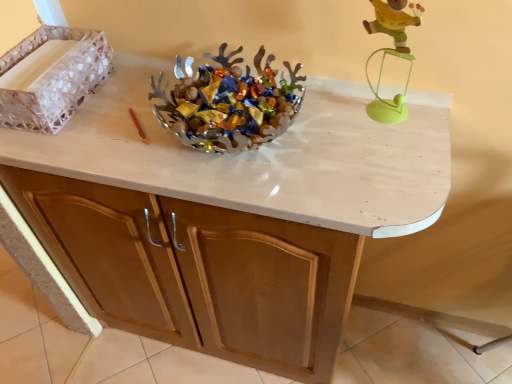
This screenshot has width=512, height=384. What do you see at coordinates (197, 272) in the screenshot? I see `matte wood cabinet at center` at bounding box center [197, 272].

What do you see at coordinates (228, 103) in the screenshot? The image size is (512, 384). I see `metallic silver bowl at center` at bounding box center [228, 103].

In order to face metallic silver bowl at center, should I rotate leftwards or rightwards?

Rotate your view left by about 4.968°.

Find the location of a particular element. The height and width of the screenshot is (384, 512). matte wood cabinet at center is located at coordinates coord(197,272).

Locate an element on the screen. The width and height of the screenshot is (512, 384). stuff below the white textured tray at left (from the image's perspective) is located at coordinates (228, 103).

Is white textured tray at left directly adjacent to metallic silver bowl at center?

white textured tray at left is not next to metallic silver bowl at center, and they're not touching.

Is white textured tray at left looking in the opposite direction of metallic silver bowl at center?

No, white textured tray at left is not facing away from metallic silver bowl at center.

In terms of height, does white textured tray at left look taller or shorter compared to matte wood cabinet at center?

Considering their sizes, white textured tray at left has less height than matte wood cabinet at center.

Is point (35, 108) positioned in front of point (101, 254)?

That is True.

In the scene shown: Is white textured tray at left wider than matte wood cabinet at center?

No.

At what (x,y) coordinates should I click in order to perform the action: click on cabinetry in front of the metallic silver bowl at center. Please return your answer as a coordinate pair (x, y). Looking at the image, I should click on (197, 272).

Considering the relative sizes of metallic silver bowl at center and matte wood cabinet at center in the image provided, is metallic silver bowl at center smaller than matte wood cabinet at center?

Yes, metallic silver bowl at center is smaller than matte wood cabinet at center.

Is matte wood cabinet at center located within metallic silver bowl at center?

That's incorrect, matte wood cabinet at center is not inside metallic silver bowl at center.

Are metallic silver bowl at center and matte wood cabinet at center located far from each other?

metallic silver bowl at center is actually quite close to matte wood cabinet at center.

Based on the photo, is wooden figure at upper right wider or thinner than metallic silver bowl at center?

wooden figure at upper right is thinner than metallic silver bowl at center.

Would you say wooden figure at upper right contains metallic silver bowl at center?

No, metallic silver bowl at center is not surrounded by wooden figure at upper right.

Can you confirm if wooden figure at upper right is taller than metallic silver bowl at center?

Indeed, wooden figure at upper right has a greater height compared to metallic silver bowl at center.

Considering the relative positions of wooden figure at upper right and metallic silver bowl at center in the image provided, is wooden figure at upper right to the left of metallic silver bowl at center from the viewer's perspective?

In fact, wooden figure at upper right is to the right of metallic silver bowl at center.

How different are the orientations of matte wood cabinet at center and metallic silver bowl at center in degrees?

0.344 degrees separate the facing orientations of matte wood cabinet at center and metallic silver bowl at center.

Is matte wood cabinet at center aimed at metallic silver bowl at center?

No, matte wood cabinet at center does not turn towards metallic silver bowl at center.

Relative to metallic silver bowl at center, is matte wood cabinet at center in front or behind?

matte wood cabinet at center is positioned closer to the viewer than metallic silver bowl at center.

From the image's perspective, is matte wood cabinet at center located above metallic silver bowl at center?

Incorrect, from the image's perspective, matte wood cabinet at center is lower than metallic silver bowl at center.

Between matte wood cabinet at center and wooden figure at upper right, which one appears on the right side from the viewer's perspective?

wooden figure at upper right.

Find the location of a particular element. This screenshot has height=384, width=512. toy above the matte wood cabinet at center (from a real-world perspective) is located at coordinates (391, 54).

Is wooden figure at upper right at the back of matte wood cabinet at center?

No, matte wood cabinet at center is not facing the opposite direction of wooden figure at upper right.

Which object is thinner, matte wood cabinet at center or wooden figure at upper right?

wooden figure at upper right.

Between point (187, 95) and point (78, 53), which one is positioned in front?

The point (187, 95) is more forward.

Looking at this image, can you confirm if metallic silver bowl at center is shorter than white textured tray at left?

Correct, metallic silver bowl at center is not as tall as white textured tray at left.

Considering the sizes of objects metallic silver bowl at center and white textured tray at left in the image provided, who is wider, metallic silver bowl at center or white textured tray at left?

With larger width is metallic silver bowl at center.

Is metallic silver bowl at center aimed at white textured tray at left?

No, metallic silver bowl at center is not turned towards white textured tray at left.

In order to click on crate on the left of metallic silver bowl at center in this screenshot , I will do `click(54, 79)`.

Identify the location of cabinetry that is on the right side of white textured tray at left. (197, 272).

Based on their spatial positions, is white textured tray at left or matte wood cabinet at center further from wooden figure at upper right?

white textured tray at left is positioned further to the anchor wooden figure at upper right.

When comparing their distances from white textured tray at left, does wooden figure at upper right or metallic silver bowl at center seem closer?

metallic silver bowl at center lies closer to white textured tray at left than the other object.

Estimate the real-world distances between objects in this image. Which object is further from matte wood cabinet at center, metallic silver bowl at center or white textured tray at left?

Among the two, white textured tray at left is located further to matte wood cabinet at center.

Estimate the real-world distances between objects in this image. Which object is further from white textured tray at left, matte wood cabinet at center or metallic silver bowl at center?

matte wood cabinet at center is further to white textured tray at left.

Considering their positions, is white textured tray at left positioned further to wooden figure at upper right than metallic silver bowl at center?

The object further to wooden figure at upper right is white textured tray at left.

Based on their spatial positions, is matte wood cabinet at center or wooden figure at upper right further from white textured tray at left?

Among the two, wooden figure at upper right is located further to white textured tray at left.

Looking at this image, considering their positions, is matte wood cabinet at center positioned closer to wooden figure at upper right than white textured tray at left?

matte wood cabinet at center.

When comparing their distances from matte wood cabinet at center, does wooden figure at upper right or metallic silver bowl at center seem closer?

Among the two, metallic silver bowl at center is located nearer to matte wood cabinet at center.

You are a GUI agent. You are given a task and a screenshot of the screen. Output one action in this format:
    pyautogui.click(x=<x>, y=<y>)
    Task: Click on the stuff between wooden figure at upper right and matte wood cabinet at center vertically
    
    Given the screenshot: What is the action you would take?
    pyautogui.click(x=228, y=103)

This screenshot has height=384, width=512. What are the coordinates of `stuff situated between white textured tray at left and matte wood cabinet at center from left to right` in the screenshot? It's located at (228, 103).

Where is `cabinetry located between white textured tray at left and wooden figure at upper right in the left-right direction`? cabinetry located between white textured tray at left and wooden figure at upper right in the left-right direction is located at coordinates (197, 272).

The width and height of the screenshot is (512, 384). What are the coordinates of `stuff situated between white textured tray at left and wooden figure at upper right from left to right` in the screenshot? It's located at (228, 103).